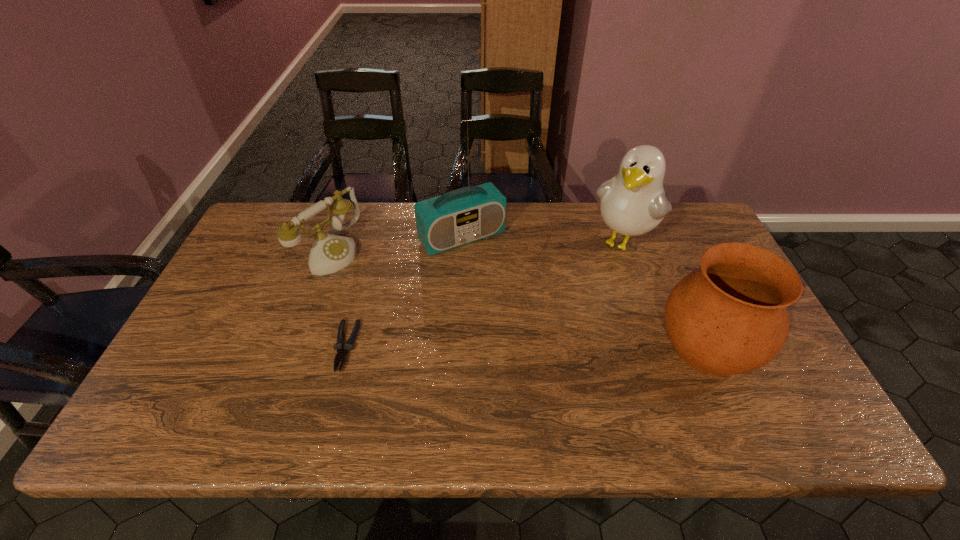
You are a GUI agent. You are given a task and a screenshot of the screen. Output one action in this format:
    pyautogui.click(x=<x>, y=<y>)
    Task: Click on the fourth object from right to left
    This screenshot has height=540, width=960.
    Given the screenshot: What is the action you would take?
    click(x=348, y=346)

At what (x,y) coordinates should I click in order to perform the action: click on the shortest object. Please return your answer as a coordinate pair (x, y). This screenshot has width=960, height=540. Looking at the image, I should click on 348,346.

This screenshot has width=960, height=540. I want to click on the third shortest object, so click(730, 317).

Image resolution: width=960 pixels, height=540 pixels. Identify the location of the fourth tallest object. (329, 253).

Where is `the leftmost object`? The image size is (960, 540). the leftmost object is located at coordinates (329, 253).

Where is `radio receiver`? radio receiver is located at coordinates (458, 217).

At what (x,y) coordinates should I click in order to perform the action: click on gull. Please return your answer as a coordinate pair (x, y). This screenshot has width=960, height=540. Looking at the image, I should click on (632, 203).

I want to click on blank area located on the back of the pottery, so click(675, 274).

The height and width of the screenshot is (540, 960). I want to click on free region located on the dial of the second shortest object, so click(380, 285).

Find the location of a particular element. free space located 0.340m on the dial of the second shortest object is located at coordinates (438, 318).